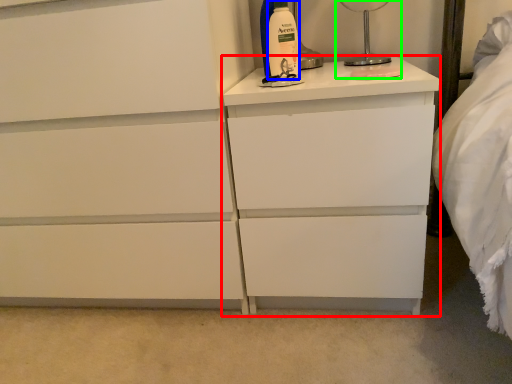
Question: Considering the real-world distances, which object is closest to nightstand (highlighted by a red box)? cleaning product (highlighted by a blue box) or bedside lamp (highlighted by a green box).

Choices:
 (A) cleaning product
 (B) bedside lamp

Answer: (A)